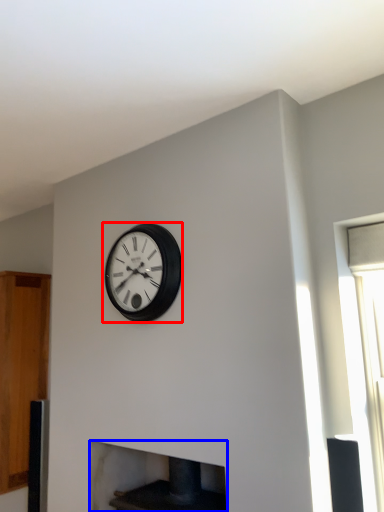
Question: Which object appears closest to the camera in this image, wall clock (highlighted by a red box) or fireplace (highlighted by a blue box)?

Choices:
 (A) wall clock
 (B) fireplace

Answer: (B)